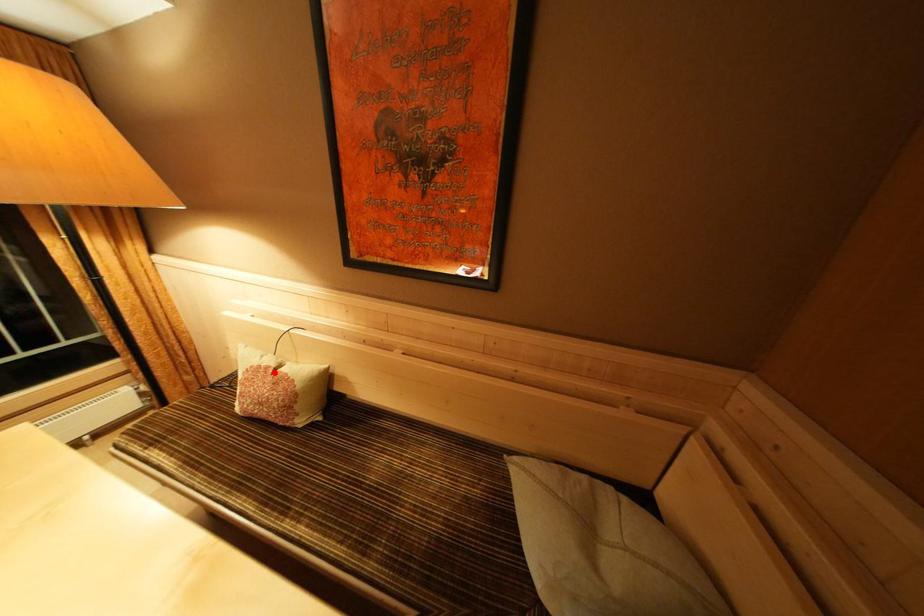
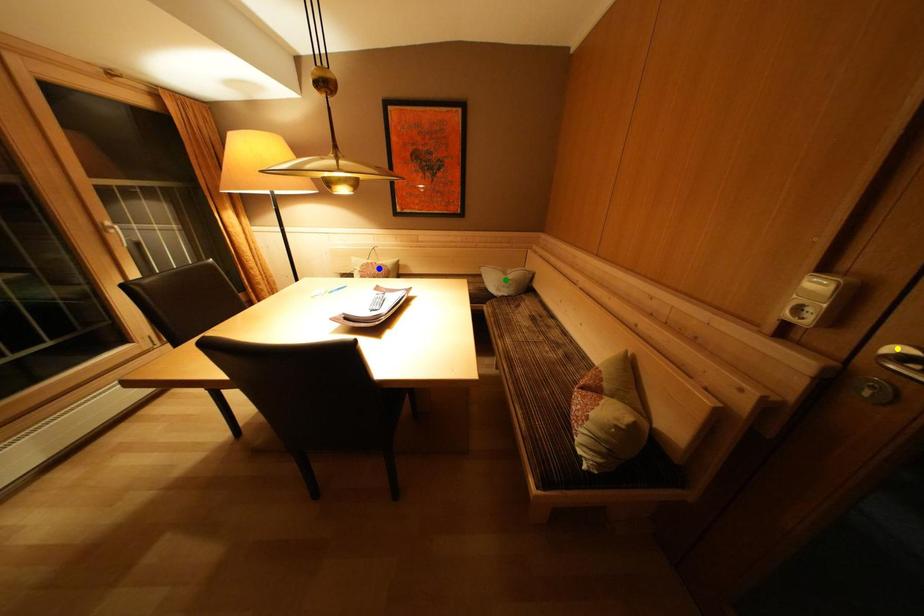
Question: I am providing you with two images of the same scene from different viewpoints. A red point is marked on the first image. You are given multiple points on the second image. Which point in image 2 is actually the same real-world point as the red point in image 1?

Choices:
 (A) blue point
 (B) yellow point
 (C) green point

Answer: (A)